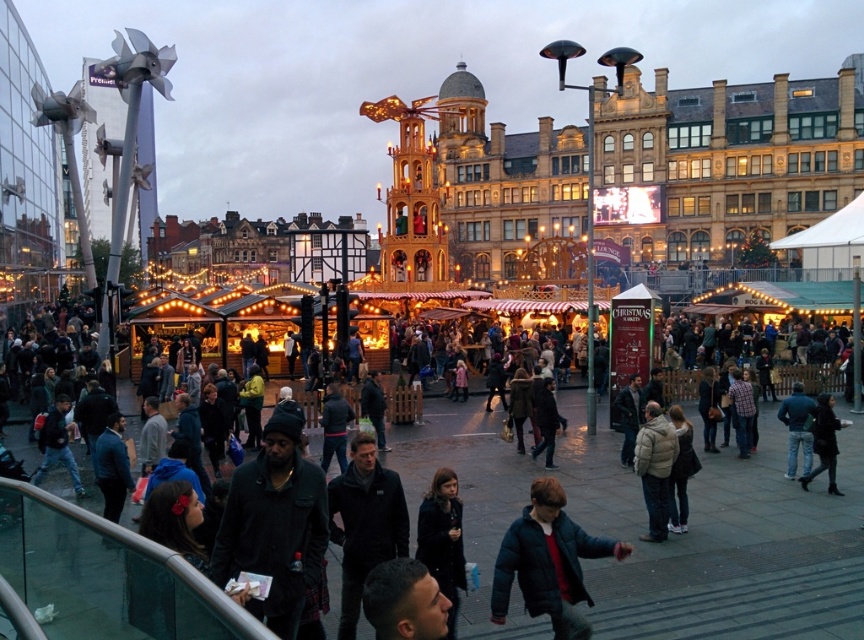
Who is positioned more to the left, dark blue jacket at center or dark gray jacket at center?

dark blue jacket at center

Which is in front, point (519, 586) or point (650, 460)?

Positioned in front is point (519, 586).

Locate an element on the screen. The image size is (864, 640). dark blue jacket at center is located at coordinates (548, 563).